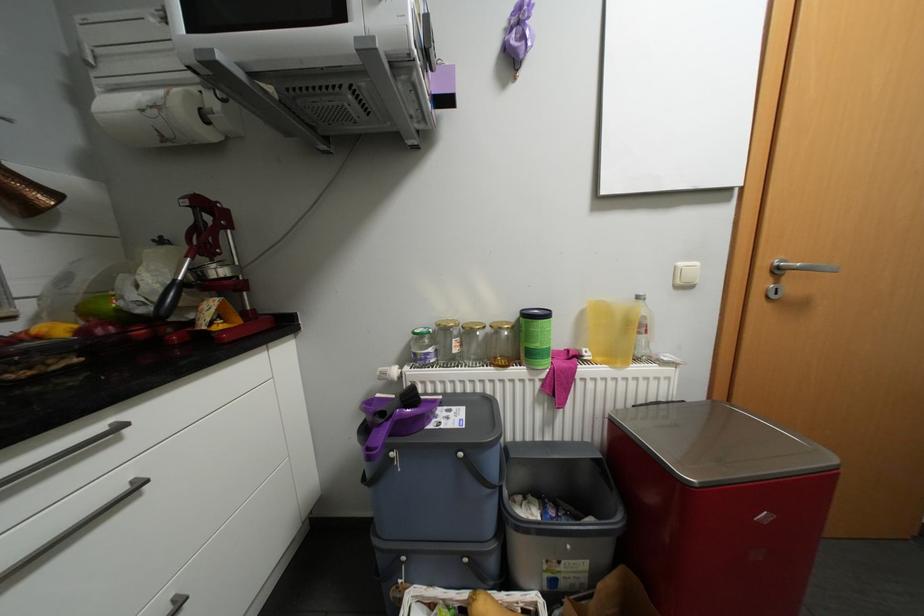
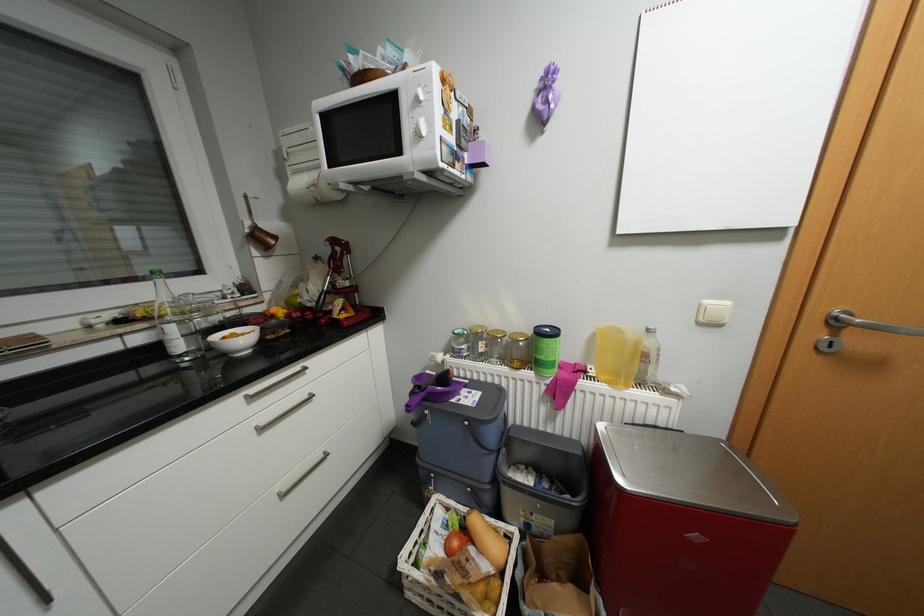
In the second image, find the point that corresponds to point (594, 354) in the first image.

(600, 371)